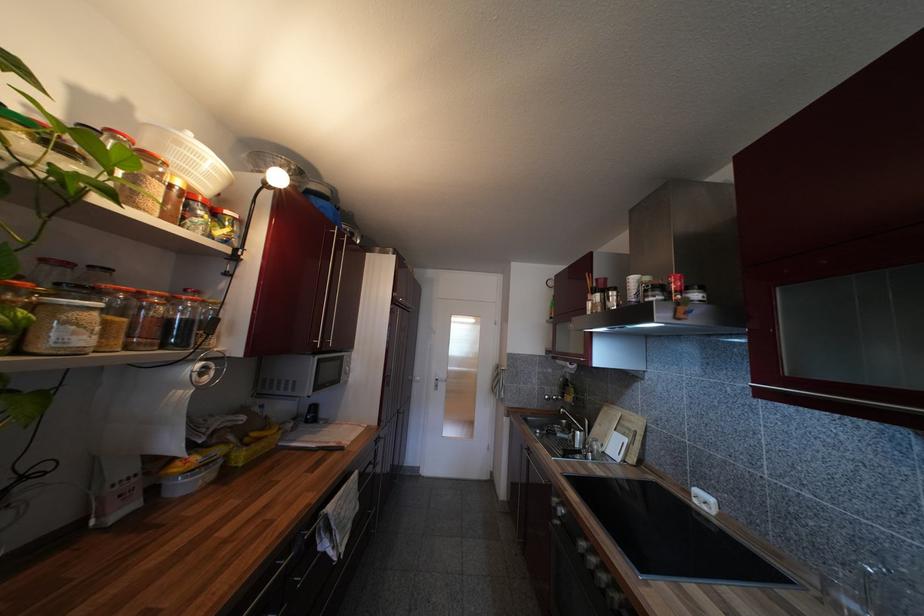
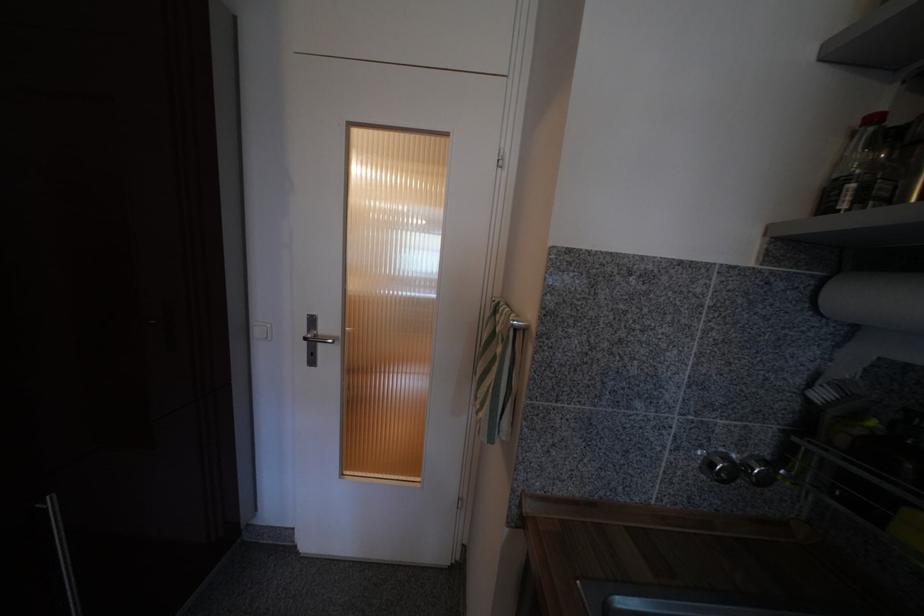
Locate, in the second image, the point that corresponds to point (500, 395) in the first image.

(485, 407)